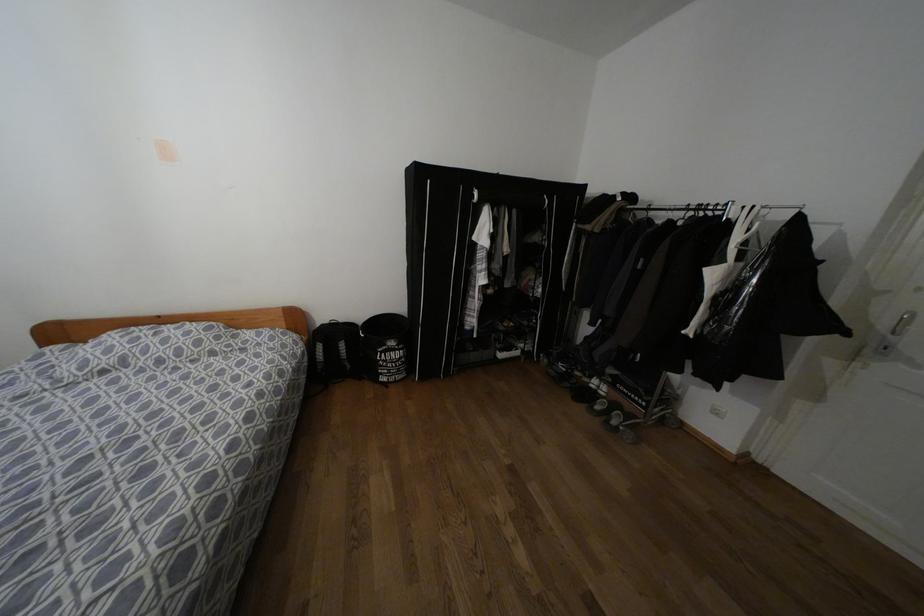
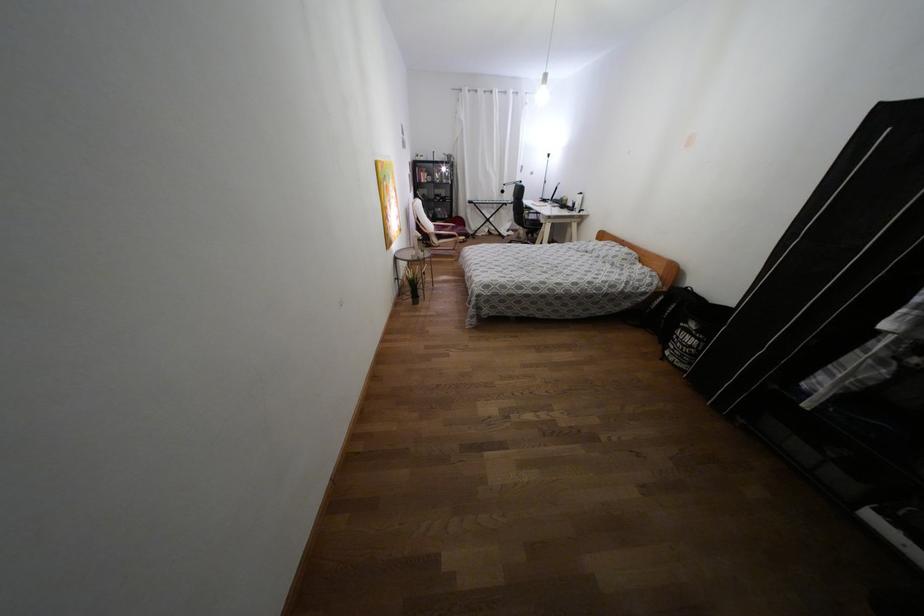
Where in the second image is the point corresponding to (x=384, y=361) from the first image?

(676, 337)